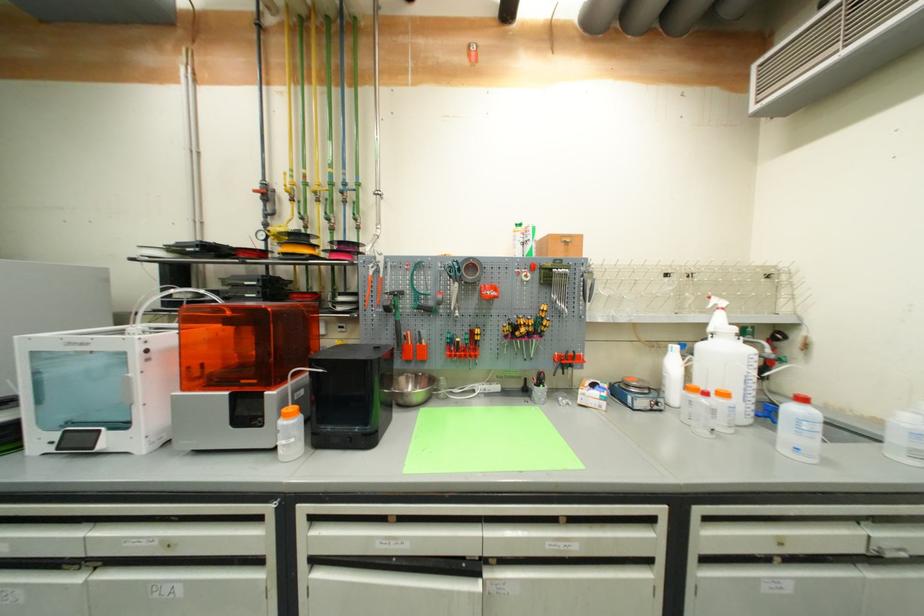
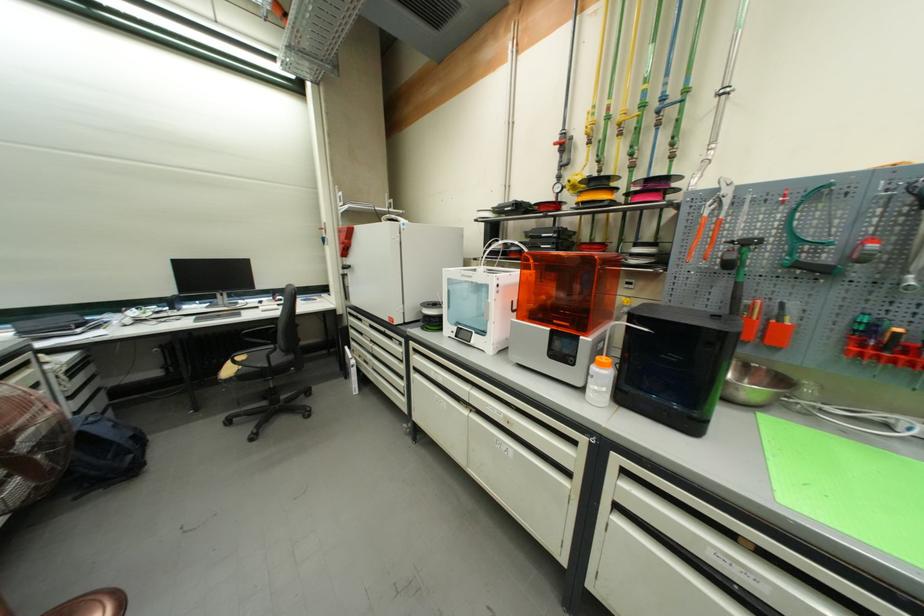
Locate, in the second image, the point that corresponds to (x=424, y=307) in the first image.

(803, 262)